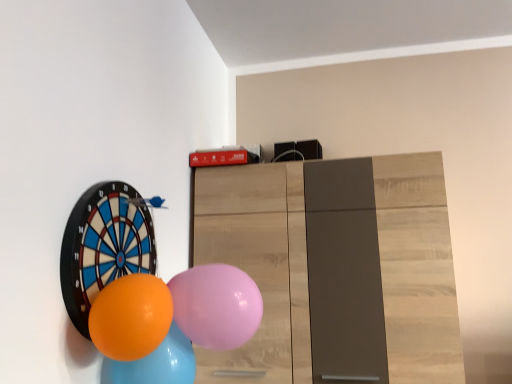
Question: Is orange glossy balloon at lower left, which is the 2th balloon in right-to-left order, surrounding pink rubber balloon at center, the fourth balloon viewed from the left?

Choices:
 (A) no
 (B) yes

Answer: (A)

Question: From the image's perspective, is orange glossy balloon at lower left, the 3th balloon viewed from the left, located beneath pink rubber balloon at center, which is the 1th balloon in right-to-left order?

Choices:
 (A) no
 (B) yes

Answer: (B)

Question: Is orange glossy balloon at lower left, the 3th balloon viewed from the left, at the right side of pink rubber balloon at center, the fourth balloon viewed from the left?

Choices:
 (A) yes
 (B) no

Answer: (B)

Question: Is orange glossy balloon at lower left, which is the 2th balloon in right-to-left order, shorter than pink rubber balloon at center, which is the 1th balloon in right-to-left order?

Choices:
 (A) yes
 (B) no

Answer: (A)

Question: Can you confirm if orange glossy balloon at lower left, which is the 2th balloon in right-to-left order, is wider than pink rubber balloon at center, the fourth balloon viewed from the left?

Choices:
 (A) yes
 (B) no

Answer: (B)

Question: In the image, is orange glossy balloon at lower left, arranged as the third balloon when viewed from the right, positioned in front of or behind orange rubber balloon at left, the fourth balloon from the right?

Choices:
 (A) front
 (B) behind

Answer: (B)

Question: From a real-world perspective, relative to orange rubber balloon at left, the 1th balloon in the left-to-right sequence, is orange glossy balloon at lower left, arranged as the third balloon when viewed from the right, vertically above or below?

Choices:
 (A) above
 (B) below

Answer: (B)

Question: Looking at their shapes, would you say orange glossy balloon at lower left, which is the 2th balloon from left to right, is wider or thinner than orange rubber balloon at left, the 1th balloon in the left-to-right sequence?

Choices:
 (A) wide
 (B) thin

Answer: (A)

Question: Does point (126, 362) appear closer or farther from the camera than point (105, 200)?

Choices:
 (A) closer
 (B) farther

Answer: (A)

Question: Is point (77, 294) closer or farther from the camera than point (159, 352)?

Choices:
 (A) closer
 (B) farther

Answer: (A)

Question: In the image, is orange rubber balloon at left, the fourth balloon from the right, on the left side or the right side of orange glossy balloon at lower left, arranged as the third balloon when viewed from the right?

Choices:
 (A) right
 (B) left

Answer: (B)

Question: In terms of height, does orange rubber balloon at left, the 1th balloon in the left-to-right sequence, look taller or shorter compared to orange glossy balloon at lower left, arranged as the third balloon when viewed from the right?

Choices:
 (A) short
 (B) tall

Answer: (B)

Question: Based on their sizes in the image, would you say orange rubber balloon at left, the 1th balloon in the left-to-right sequence, is bigger or smaller than orange glossy balloon at lower left, arranged as the third balloon when viewed from the right?

Choices:
 (A) small
 (B) big

Answer: (A)

Question: Based on their sizes in the image, would you say orange rubber balloon at left, the 1th balloon in the left-to-right sequence, is bigger or smaller than orange glossy balloon at lower left, the 3th balloon viewed from the left?

Choices:
 (A) big
 (B) small

Answer: (A)

Question: Relative to orange glossy balloon at lower left, which is the 2th balloon in right-to-left order, is orange rubber balloon at left, the 1th balloon in the left-to-right sequence, in front or behind?

Choices:
 (A) behind
 (B) front

Answer: (A)